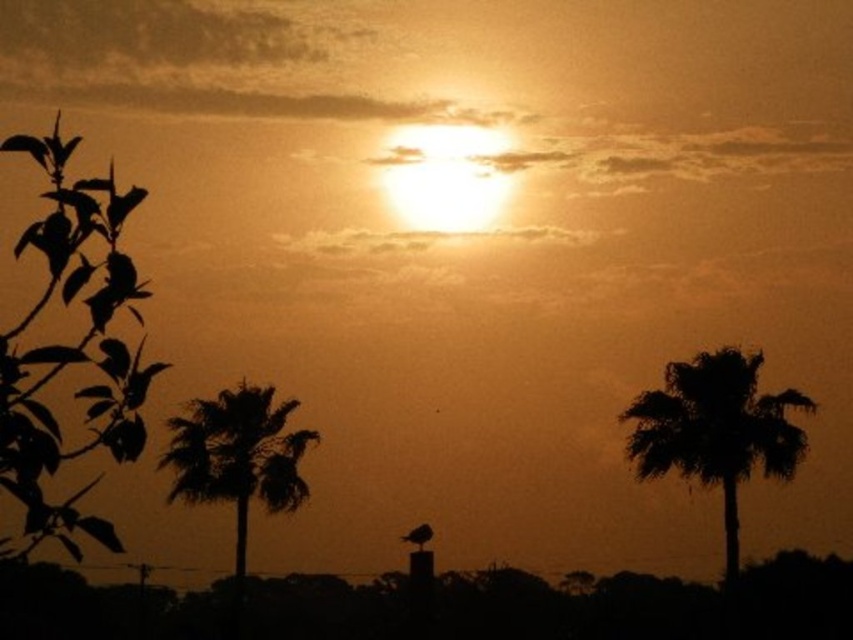
Who is lower down, green leafy plant at left or silhouette palm tree at left?

Positioned lower is silhouette palm tree at left.

Find the location of a particular element. The height and width of the screenshot is (640, 853). green leafy plant at left is located at coordinates (73, 348).

In the scene shown: Can you confirm if silhouette palm tree at right is wider than silhouette palm tree at left?

Yes, silhouette palm tree at right is wider than silhouette palm tree at left.

Is silhouette palm tree at right behind silhouette palm tree at left?

No.

You are a GUI agent. You are given a task and a screenshot of the screen. Output one action in this format:
    pyautogui.click(x=<x>, y=<y>)
    Task: Click on the silhouette palm tree at right
    The height and width of the screenshot is (640, 853).
    Given the screenshot: What is the action you would take?
    pyautogui.click(x=717, y=429)

Is the position of green leafy plant at left more distant than that of silhouette palm tree at right?

No.

Is green leafy plant at left closer to camera compared to silhouette palm tree at right?

Yes, it is in front of silhouette palm tree at right.

Where is `green leafy plant at left`? Image resolution: width=853 pixels, height=640 pixels. green leafy plant at left is located at coordinates (73, 348).